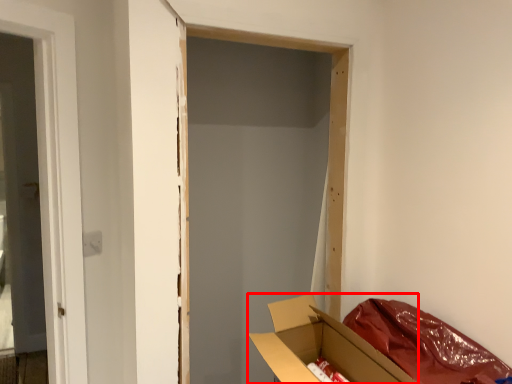
Question: From the image's perspective, what is the correct spatial relationship of box (annotated by the red box) in relation to curtain?

Choices:
 (A) below
 (B) above

Answer: (A)